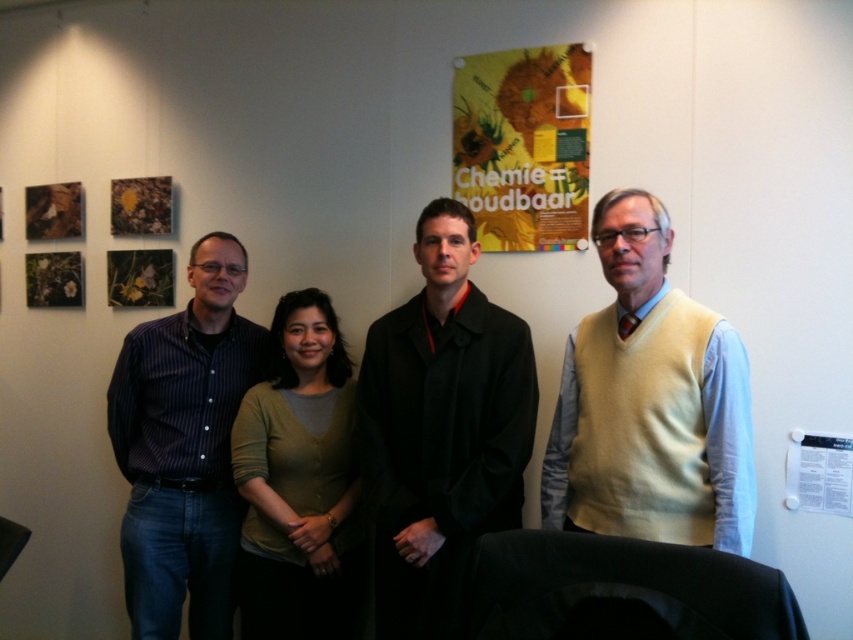
Question: Does dark blue striped shirt at left appear over green cardigan at center?

Choices:
 (A) no
 (B) yes

Answer: (B)

Question: Is yellow paper poster at upper center smaller than white paper at lower right?

Choices:
 (A) yes
 (B) no

Answer: (B)

Question: Among these points, which one is farthest from the camera?

Choices:
 (A) (425, 480)
 (B) (512, 77)
 (C) (849, 483)
 (D) (287, 525)

Answer: (B)

Question: Does yellow sweater vest at right have a greater width compared to black matte coat at center?

Choices:
 (A) yes
 (B) no

Answer: (B)

Question: Among these objects, which one is farthest from the camera?

Choices:
 (A) yellow sweater vest at right
 (B) white paper at lower right

Answer: (B)

Question: Based on their relative distances, which object is farther from the white paper at lower right?

Choices:
 (A) black matte coat at center
 (B) dark blue striped shirt at left
 (C) yellow sweater vest at right

Answer: (B)